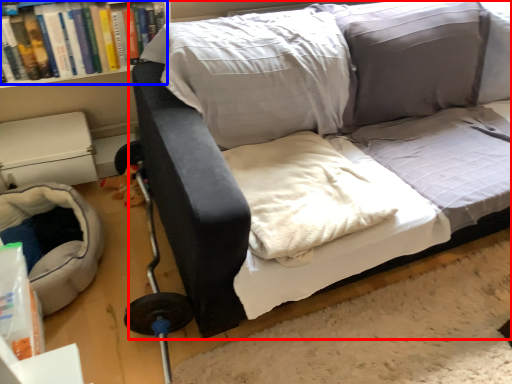
Question: Which point is further to the camera, studio couch (highlighted by a red box) or book (highlighted by a blue box)?

Choices:
 (A) studio couch
 (B) book

Answer: (B)